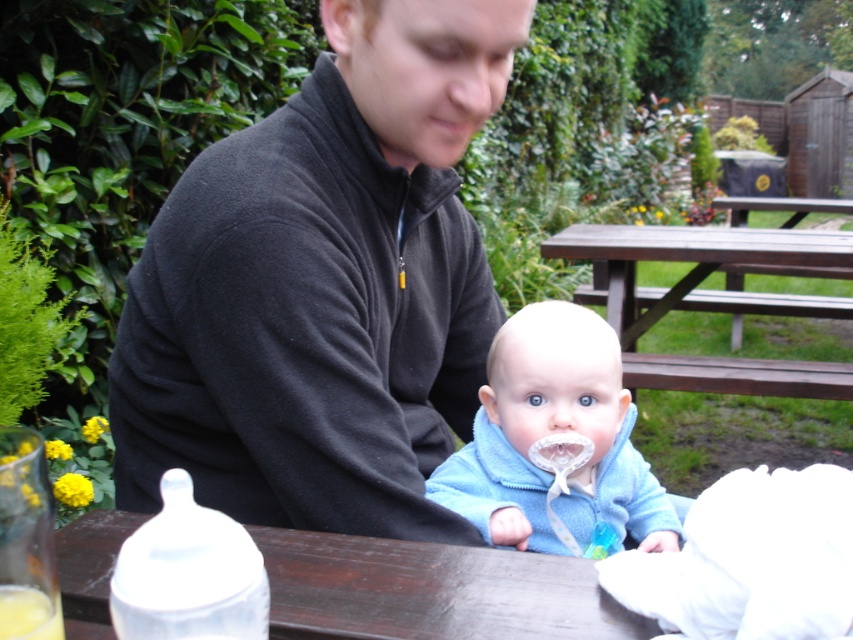
Question: Is transparent plastic bottle at lower center in front of transparent plastic bottle at lower left?

Choices:
 (A) no
 (B) yes

Answer: (A)

Question: Estimate the real-world distances between objects in this image. Which object is farther from the brown wooden picnic table at center?

Choices:
 (A) transparent plastic bottle at lower center
 (B) black fleece jacket at upper center
 (C) blue fleece jacket at center
 (D) transparent plastic bottle at lower left

Answer: (D)

Question: Does transparent plastic bottle at lower center come behind transparent plastic bottle at lower left?

Choices:
 (A) yes
 (B) no

Answer: (A)

Question: Considering the relative positions of transparent plastic bottle at lower center and brown wooden picnic table at center in the image provided, where is transparent plastic bottle at lower center located with respect to brown wooden picnic table at center?

Choices:
 (A) left
 (B) right

Answer: (A)

Question: Which object appears closest to the camera in this image?

Choices:
 (A) transparent plastic bottle at lower center
 (B) brown wooden picnic table at center
 (C) transparent plastic bottle at lower left

Answer: (C)

Question: Which point is closer to the camera taking this photo?

Choices:
 (A) (587, 476)
 (B) (322, 304)

Answer: (B)